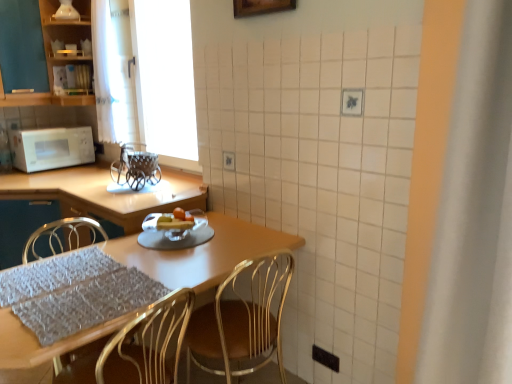
Question: Is wooden table at center completely or partially outside of matte black cabinet at upper left?

Choices:
 (A) no
 (B) yes

Answer: (B)

Question: Does wooden table at center lie in front of matte black cabinet at upper left?

Choices:
 (A) no
 (B) yes

Answer: (B)

Question: Is wooden table at center to the left of matte black cabinet at upper left from the viewer's perspective?

Choices:
 (A) yes
 (B) no

Answer: (B)

Question: Is wooden table at center next to matte black cabinet at upper left?

Choices:
 (A) no
 (B) yes

Answer: (A)

Question: From a real-world perspective, is wooden table at center under matte black cabinet at upper left?

Choices:
 (A) no
 (B) yes

Answer: (B)

Question: Can you confirm if wooden table at center is positioned to the right of matte black cabinet at upper left?

Choices:
 (A) yes
 (B) no

Answer: (A)

Question: Is wooden table at center at the back of metallic gold chair at center?

Choices:
 (A) yes
 (B) no

Answer: (A)

Question: Is metallic gold chair at center not near wooden table at center?

Choices:
 (A) no
 (B) yes

Answer: (A)

Question: From a real-world perspective, does metallic gold chair at center stand above wooden table at center?

Choices:
 (A) no
 (B) yes

Answer: (B)

Question: Is wooden table at center located within metallic gold chair at center?

Choices:
 (A) no
 (B) yes

Answer: (A)

Question: Is metallic gold chair at center completely or partially outside of wooden table at center?

Choices:
 (A) no
 (B) yes

Answer: (A)

Question: From the image's perspective, is metallic gold chair at center above wooden table at center?

Choices:
 (A) no
 (B) yes

Answer: (B)

Question: From the image's perspective, is white matte window screen at upper left beneath gray textured placemat at lower left?

Choices:
 (A) no
 (B) yes

Answer: (A)